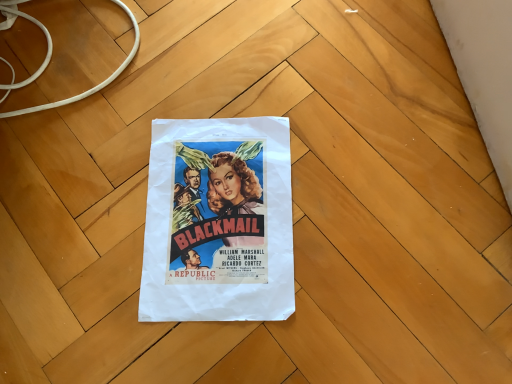
This screenshot has width=512, height=384. What do you see at coordinates (218, 221) in the screenshot? I see `white paper poster at center` at bounding box center [218, 221].

Image resolution: width=512 pixels, height=384 pixels. Find the location of `white paper poster at center`. white paper poster at center is located at coordinates (218, 221).

This screenshot has width=512, height=384. Find the location of `white paper poster at center`. white paper poster at center is located at coordinates (218, 221).